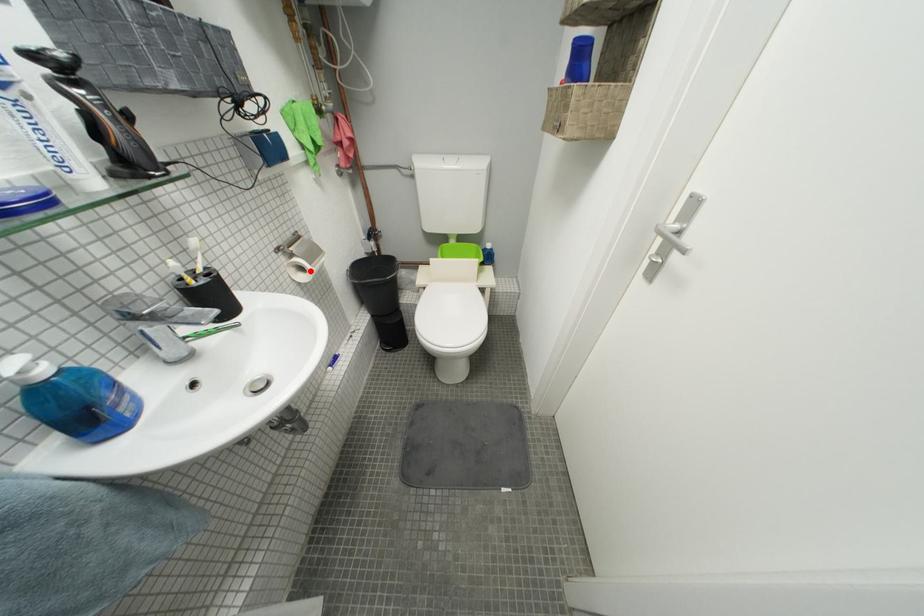
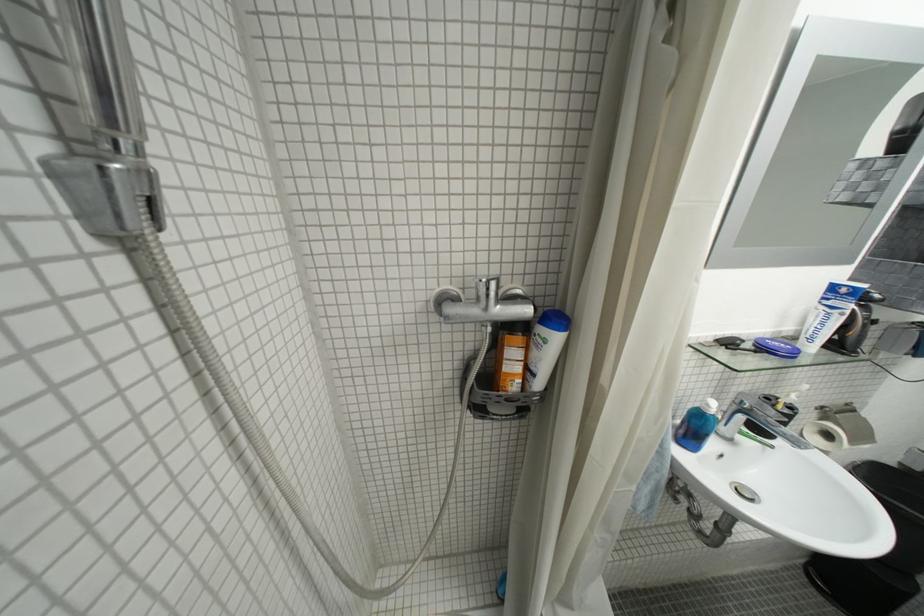
In the second image, find the point that corresponds to the highlighted location in the first image.

(836, 438)